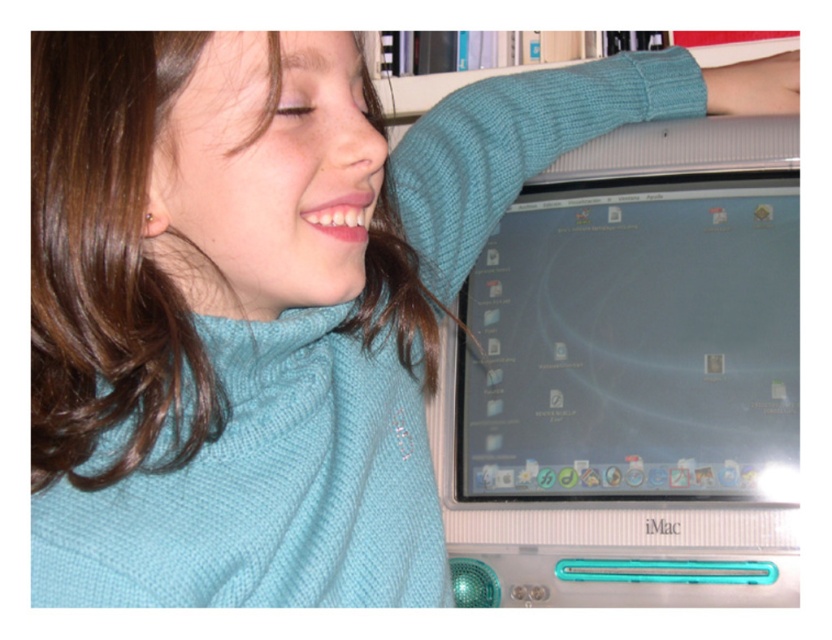
You are standing in front of the computer monitor and want to place a small sticker on the screen. The sticker needs to be placed closer to you than the other point. Which point should you choose between point (753,173) and point (506,67)?

Point (753,173) is in front of point (506,67), so you should choose point (753,173) to place the sticker closer to you.

You are a photographer taking a portrait of the person in the scene. You want to ensure the teal knitted sleeve at upper right and the satin silver monitor at center are both visible in the frame. Based on their positions, which object should you position closer to the left side of the camera frame?

The satin silver monitor at center is to the left of teal knitted sleeve at upper right, so to have both in the frame, position the satin silver monitor at center closer to the left side of the camera frame.

You are a photographer trying to capture the perfect shot of the scene. You notice the satin silver monitor at center and the teal knitted sleeve at upper right. Which object is closer to the bottom edge of the image?

The satin silver monitor at center is positioned under the teal knitted sleeve at upper right, so it is closer to the bottom edge of the image.